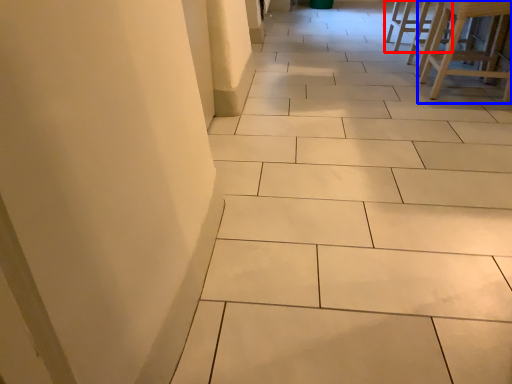
Question: Among these objects, which one is nearest to the camera, furniture (highlighted by a red box) or furniture (highlighted by a blue box)?

Choices:
 (A) furniture
 (B) furniture

Answer: (B)